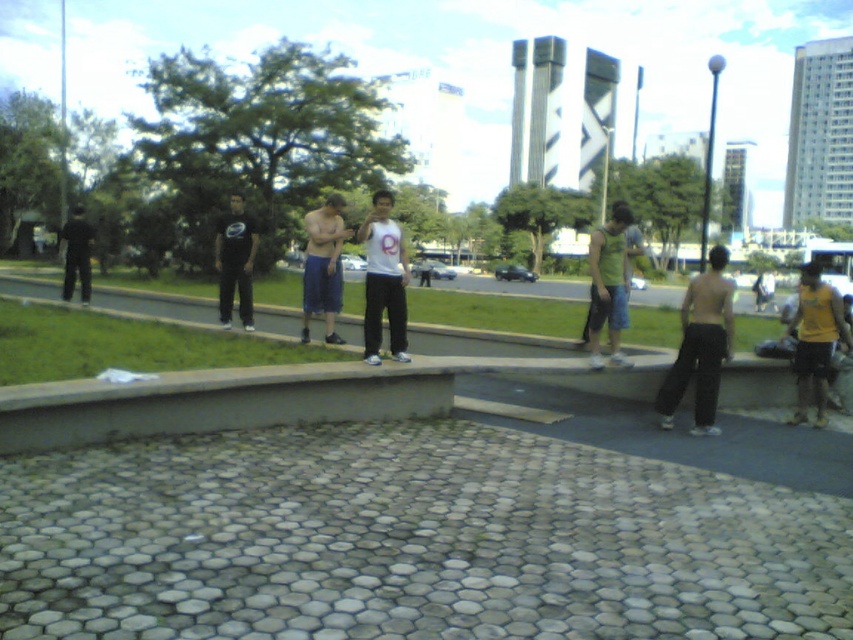
Question: Does white matte tank top at center appear under dark gray pants at left?

Choices:
 (A) no
 (B) yes

Answer: (B)

Question: Which object is closer to the camera taking this photo?

Choices:
 (A) green fabric tank top at center
 (B) black cotton pants at center
 (C) dark gray pants at left

Answer: (B)

Question: Observing the image, what is the correct spatial positioning of white matte tank top at center in reference to dark gray pants at left?

Choices:
 (A) left
 (B) right

Answer: (B)

Question: Among these objects, which one is farthest from the camera?

Choices:
 (A) green fabric tank top at center
 (B) dark gray pants at left
 (C) blue denim shorts at center

Answer: (B)

Question: Does black cotton pants at center lie behind black matte pants at center?

Choices:
 (A) yes
 (B) no

Answer: (B)

Question: Which point is farther to the camera?

Choices:
 (A) black matte pants at center
 (B) white matte tank top at center
 (C) black cotton pants at center
 (D) green fabric tank top at center

Answer: (A)